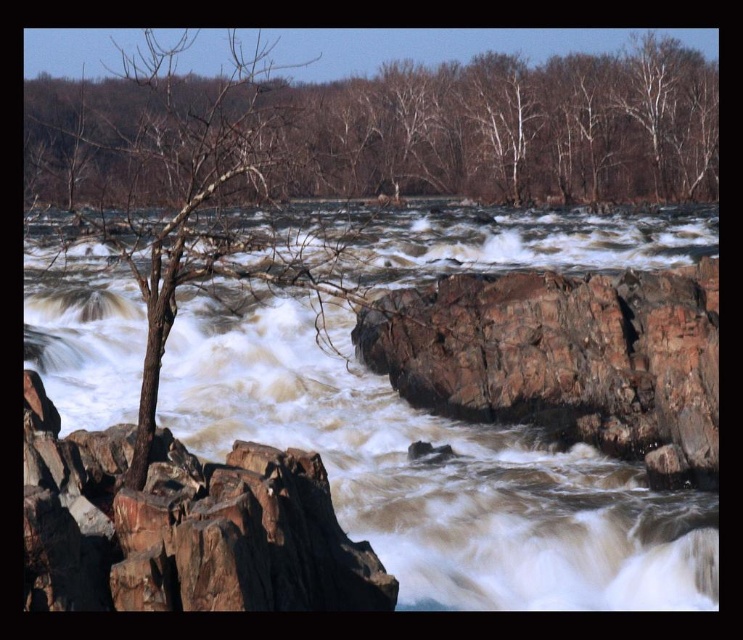
Question: Which object is farther from the camera taking this photo?

Choices:
 (A) brown rocky stream at center
 (B) rusty rock at center
 (C) brown rough rock at left

Answer: (B)

Question: Which point appears farthest from the camera in this image?

Choices:
 (A) (603, 198)
 (B) (103, 381)
 (C) (678, 307)
 (D) (360, 561)

Answer: (A)

Question: Is brown rocky stream at center positioned in front of bare branches at upper center?

Choices:
 (A) no
 (B) yes

Answer: (B)

Question: Can you confirm if bare branches at upper center is smaller than rusty rock at center?

Choices:
 (A) yes
 (B) no

Answer: (B)

Question: Which point is closer to the camera taking this photo?

Choices:
 (A) (380, 128)
 (B) (192, 573)

Answer: (B)

Question: Can you confirm if bare branches at upper center is positioned above rusty rock at center?

Choices:
 (A) yes
 (B) no

Answer: (A)